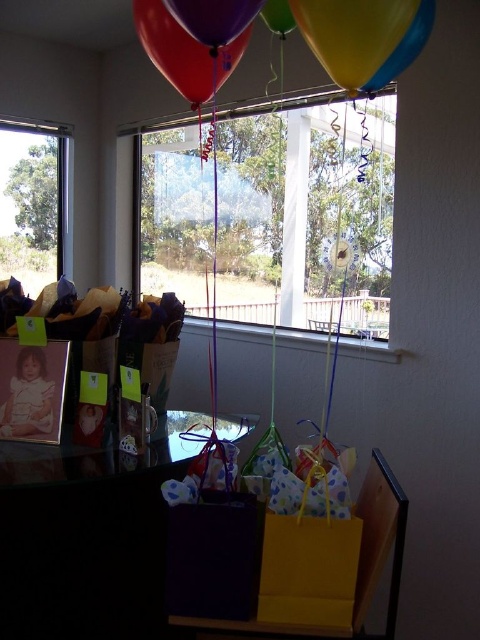
You are holding a 6.5 feet long ladder and want to place it against the transparent glass window at center. Can the ladder fit vertically within the height of the window?

The transparent glass window at center is 6.74 feet from camera. Since the ladder is 6.5 feet long, it is shorter than the window height, so the ladder can fit vertically within the height of the window.

You are at a birthday party and want to pop the yellow glossy balloon at upper center. Can you reach it without opening the clear glass window at upper left?

The yellow glossy balloon at upper center is behind the clear glass window at upper left, so you cannot reach it without opening the window first.

You are a guest at the party and want to take a photo with the balloons. Which balloon should you look up towards first, the shiny purple balloon at upper center or the shiny blue balloon at upper right?

You should look up towards the shiny blue balloon at upper right first because the shiny purple balloon at upper center is positioned under it, meaning the blue balloon is higher in the image.